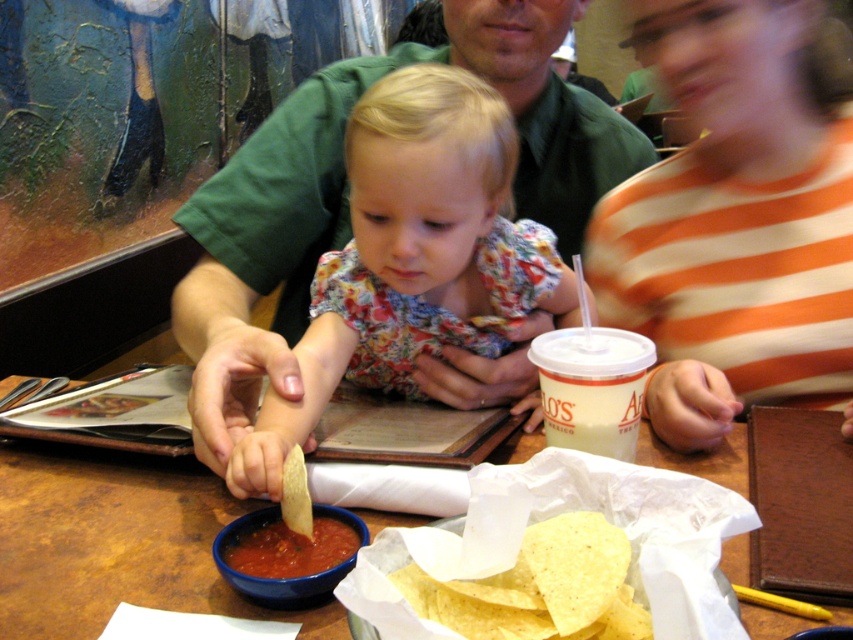
Based on the photo, in the Mexican restaurant scene, there is a wooden table at center and yellow corn tortilla chips at center. Which object takes up more space in the image?

The wooden table at center is larger in size than yellow corn corn tortilla chips at center, so the wooden table at center takes up more space in the image.